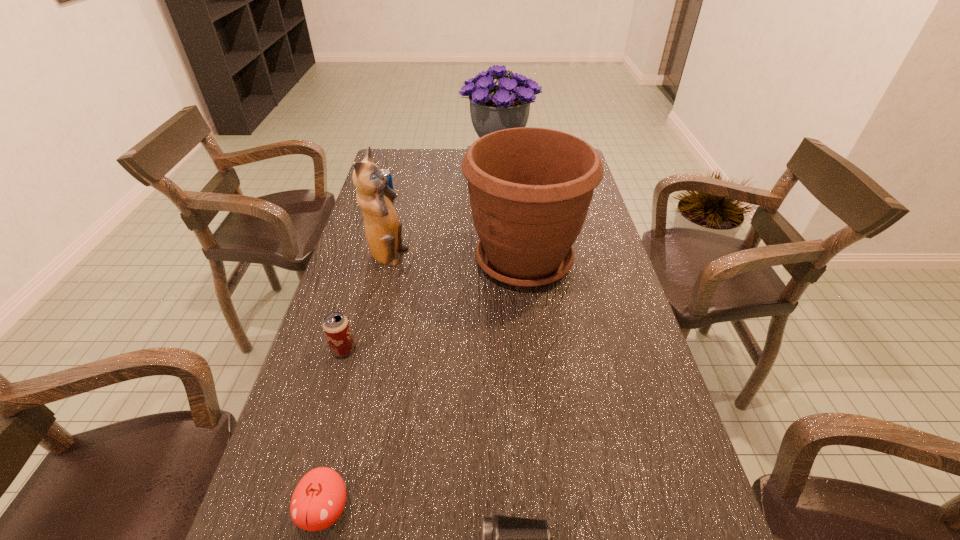
Locate an element on the screen. The height and width of the screenshot is (540, 960). bouquet is located at coordinates coord(493,107).

The width and height of the screenshot is (960, 540). In order to click on flowerpot in this screenshot , I will do `click(530, 189)`.

At what (x,y) coordinates should I click in order to perform the action: click on cat. Please return your answer as a coordinate pair (x, y). This screenshot has width=960, height=540. Looking at the image, I should click on (383, 229).

You are a GUI agent. You are given a task and a screenshot of the screen. Output one action in this format:
    pyautogui.click(x=<x>, y=<y>)
    Task: Click on the pop soda
    This screenshot has width=960, height=540.
    Given the screenshot: What is the action you would take?
    pyautogui.click(x=386, y=172)

Identify the location of the fifth farthest object. The image size is (960, 540). (336, 327).

The height and width of the screenshot is (540, 960). What are the coordinates of `free space located 0.090m on the right of the bouquet` in the screenshot? It's located at (559, 165).

Find the location of a particular element. The width and height of the screenshot is (960, 540). free region located 0.290m on the front of the flowerpot is located at coordinates (540, 396).

Where is `vacant space located on the face of the cat`? The image size is (960, 540). vacant space located on the face of the cat is located at coordinates (464, 258).

Find the location of a particular element. The height and width of the screenshot is (540, 960). free space located 0.320m on the back of the pop soda is located at coordinates (400, 154).

Where is `vacant space situated on the right of the beer can`? The height and width of the screenshot is (540, 960). vacant space situated on the right of the beer can is located at coordinates (468, 350).